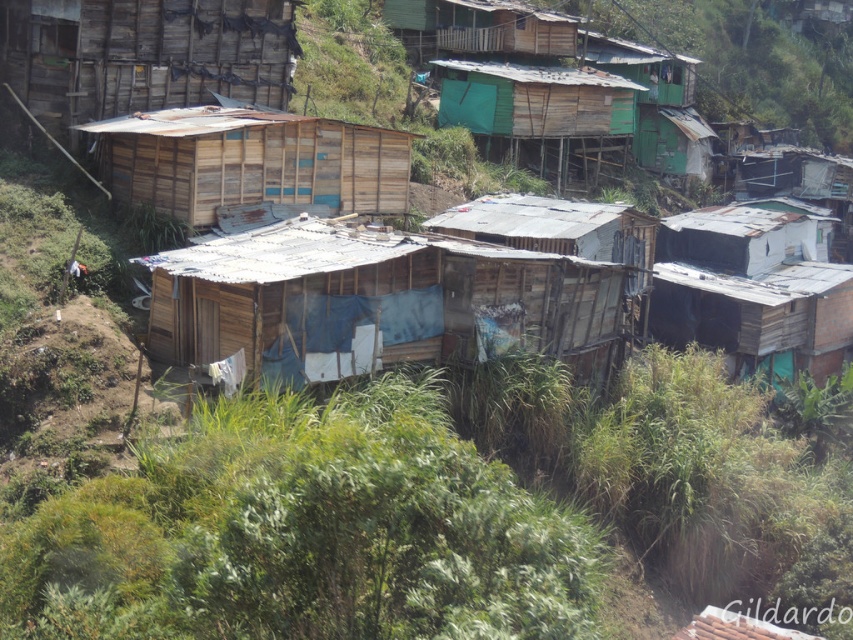
You are a delivery person trying to park your 3.5 meter wide delivery truck between the wooden shack at center and the green wooden hut at center. According to the scene description, can the truck fit in the space between them?

The wooden shack at center is wider than the green wooden hut at center. However, the exact distance between them isn not provided in the Objects Description. Therefore, it is impossible to determine if the truck can fit without additional information about the spacing between the two structures.